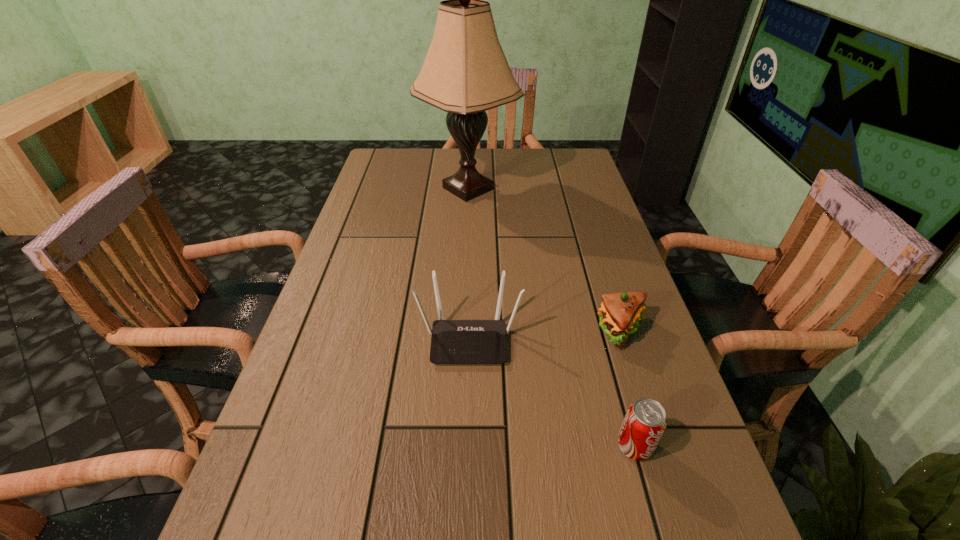
Where is `vacant space that satisfies the following two spatial constraints: 1. on the front-facing side of the router; 2. on the right side of the nearest object`? Image resolution: width=960 pixels, height=540 pixels. vacant space that satisfies the following two spatial constraints: 1. on the front-facing side of the router; 2. on the right side of the nearest object is located at coordinates [x=467, y=446].